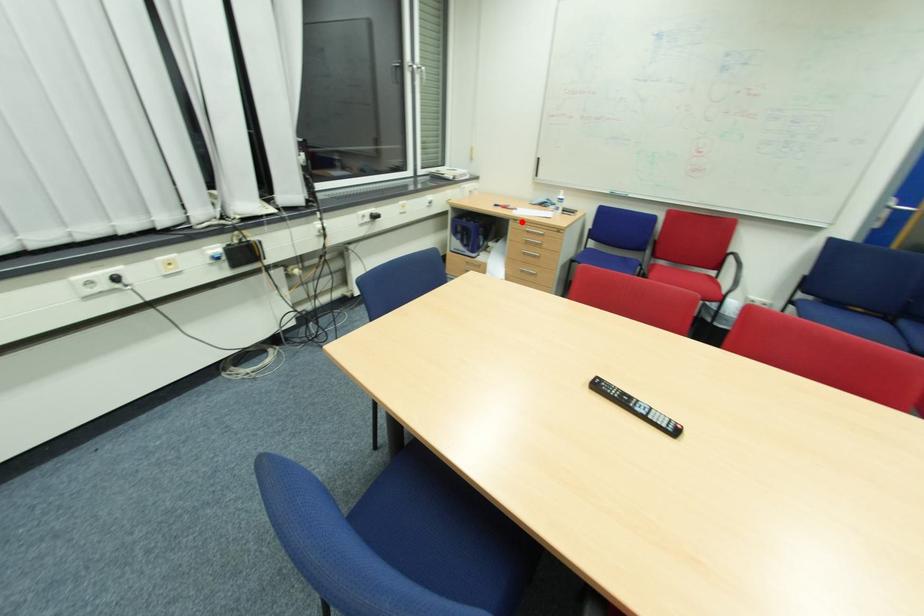
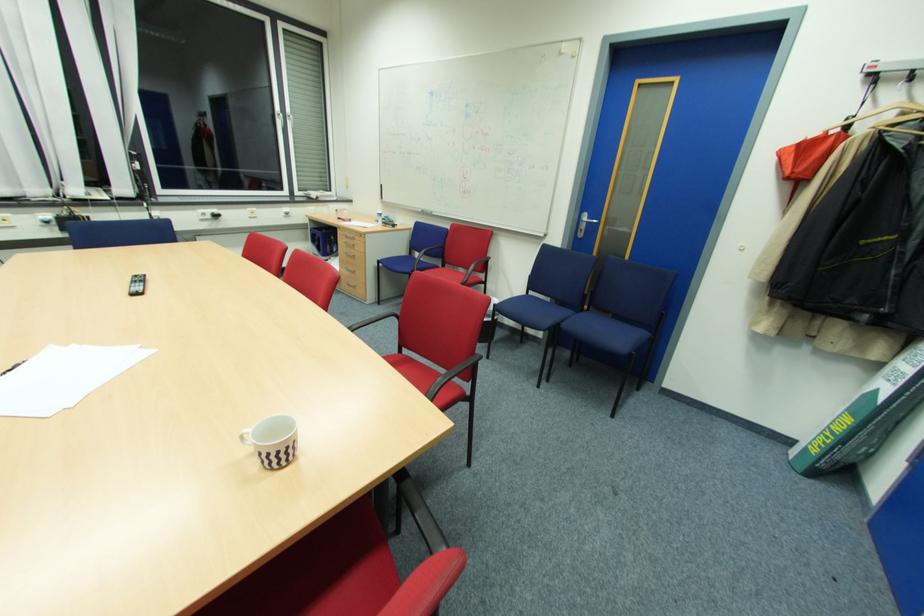
In the second image, find the point that corresponds to the highlighted location in the first image.

(344, 229)